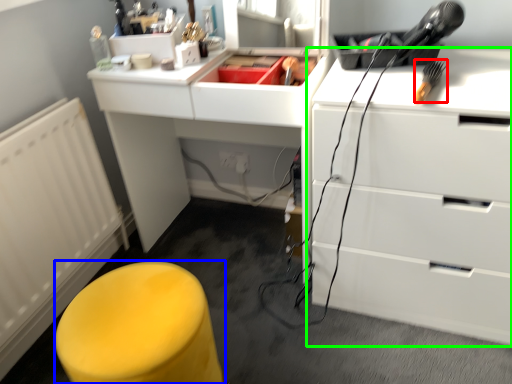
Question: Based on their relative distances, which object is farther from tool (highlighted by a red box)? Choose from furniture (highlighted by a blue box) and chest of drawers (highlighted by a green box).

Choices:
 (A) furniture
 (B) chest of drawers

Answer: (A)